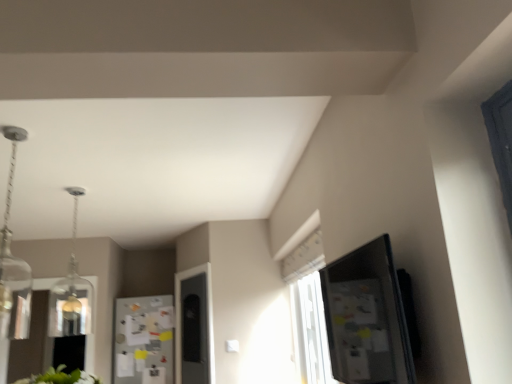
Question: From the image's perspective, is clear glass pendant at upper left, the 1th light fixture from the front, positioned above or below white paperboard fridge at center?

Choices:
 (A) above
 (B) below

Answer: (A)

Question: Is point (7, 210) closer or farther from the camera than point (155, 296)?

Choices:
 (A) farther
 (B) closer

Answer: (B)

Question: Considering the real-world distances, which object is farthest from the clear glass pendant light at upper left, which appears as the 2th light fixture when viewed from the front?

Choices:
 (A) white paperboard fridge at center
 (B) clear glass pendant at upper left, the 1th light fixture from the front

Answer: (A)

Question: Which of these objects is positioned farthest from the white paperboard fridge at center?

Choices:
 (A) clear glass pendant light at upper left, which appears as the 2th light fixture when viewed from the front
 (B) clear glass pendant at upper left, the second light fixture positioned from the back

Answer: (B)